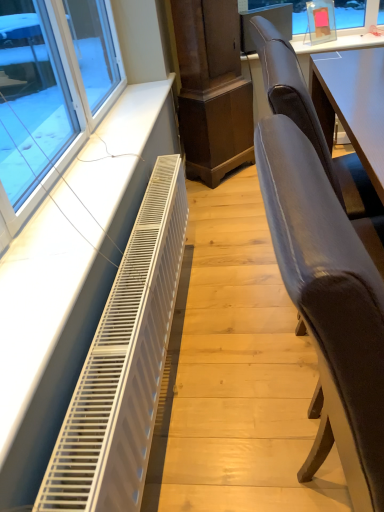
Question: Is velvet grey chair at right, positioned as the first chair in front-to-back order, next to suede-like brown chair at right, positioned as the second chair in front-to-back order?

Choices:
 (A) no
 (B) yes

Answer: (A)

Question: Considering the relative positions of velvet grey chair at right, positioned as the first chair in front-to-back order, and suede-like brown chair at right, positioned as the second chair in front-to-back order, in the image provided, is velvet grey chair at right, positioned as the first chair in front-to-back order, to the right of suede-like brown chair at right, positioned as the second chair in front-to-back order, from the viewer's perspective?

Choices:
 (A) yes
 (B) no

Answer: (B)

Question: Can you confirm if velvet grey chair at right, placed as the second chair when sorted from back to front, is smaller than suede-like brown chair at right, the first chair from the back?

Choices:
 (A) no
 (B) yes

Answer: (B)

Question: Could you tell me if velvet grey chair at right, positioned as the first chair in front-to-back order, is facing suede-like brown chair at right, positioned as the second chair in front-to-back order?

Choices:
 (A) yes
 (B) no

Answer: (B)

Question: Can you confirm if velvet grey chair at right, placed as the second chair when sorted from back to front, is positioned to the left of suede-like brown chair at right, positioned as the second chair in front-to-back order?

Choices:
 (A) no
 (B) yes

Answer: (B)

Question: From the image's perspective, would you say velvet grey chair at right, positioned as the first chair in front-to-back order, is shown under suede-like brown chair at right, positioned as the second chair in front-to-back order?

Choices:
 (A) no
 (B) yes

Answer: (B)

Question: Is velvet grey chair at right, positioned as the first chair in front-to-back order, taller than white metallic radiator at lower left?

Choices:
 (A) no
 (B) yes

Answer: (B)

Question: Is velvet grey chair at right, placed as the second chair when sorted from back to front, smaller than white metallic radiator at lower left?

Choices:
 (A) no
 (B) yes

Answer: (A)

Question: Is velvet grey chair at right, positioned as the first chair in front-to-back order, positioned in front of white metallic radiator at lower left?

Choices:
 (A) no
 (B) yes

Answer: (B)

Question: Are velvet grey chair at right, positioned as the first chair in front-to-back order, and white metallic radiator at lower left making contact?

Choices:
 (A) no
 (B) yes

Answer: (A)

Question: Is velvet grey chair at right, placed as the second chair when sorted from back to front, turned away from white metallic radiator at lower left?

Choices:
 (A) yes
 (B) no

Answer: (B)

Question: Does velvet grey chair at right, positioned as the first chair in front-to-back order, appear on the left side of white metallic radiator at lower left?

Choices:
 (A) yes
 (B) no

Answer: (B)

Question: Would you say white metallic radiator at lower left contains suede-like brown chair at right, the first chair from the back?

Choices:
 (A) no
 (B) yes

Answer: (A)